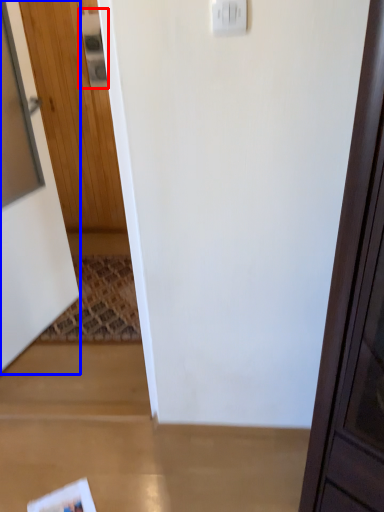
Question: Which of the following is the farthest to the observer, light switch (highlighted by a red box) or door (highlighted by a blue box)?

Choices:
 (A) light switch
 (B) door

Answer: (A)